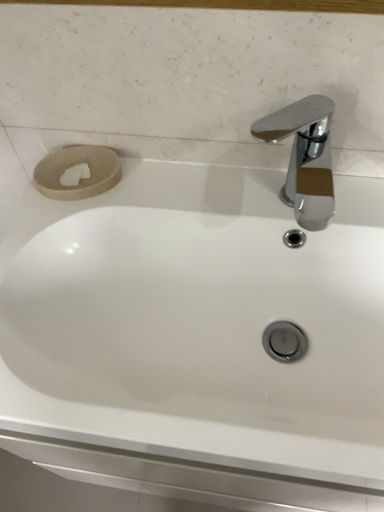
Where is `free region on the left part of chrome/metallic faucet at upper right`? This screenshot has height=512, width=384. free region on the left part of chrome/metallic faucet at upper right is located at coordinates (180, 193).